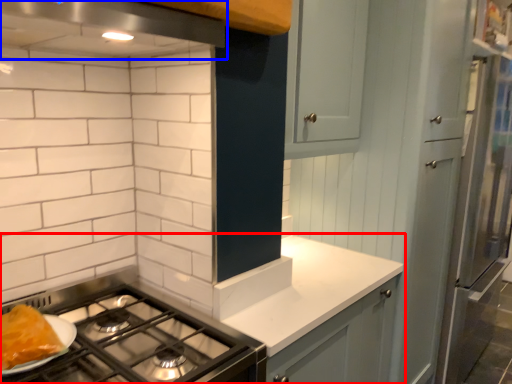
Question: Which point is closer to the camera, countertop (highlighted by a red box) or exhaust hood (highlighted by a blue box)?

Choices:
 (A) countertop
 (B) exhaust hood

Answer: (B)